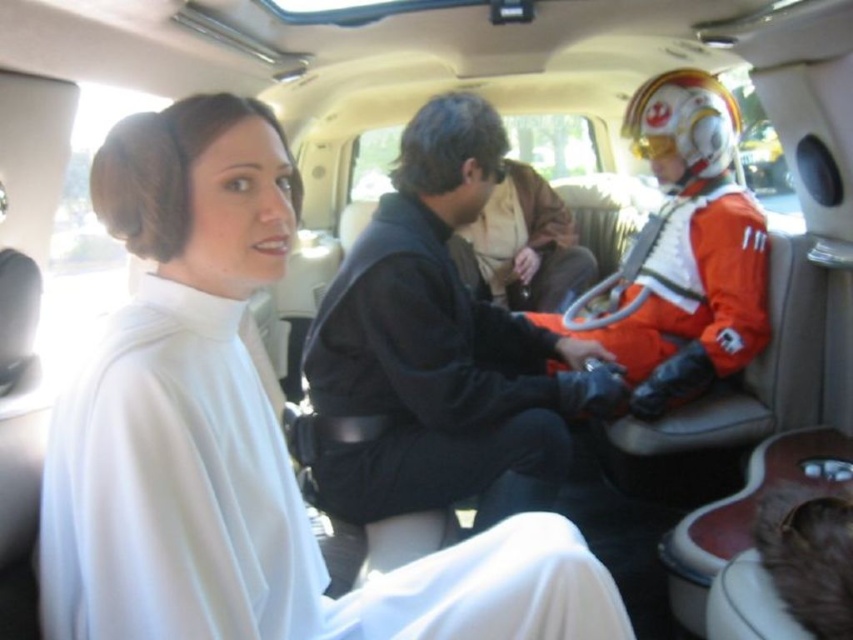
Can you confirm if black leather jacket at center is positioned above orange fabric helmet at right?

No.

Which is above, black leather jacket at center or orange fabric helmet at right?

Positioned higher is orange fabric helmet at right.

You are a GUI agent. You are given a task and a screenshot of the screen. Output one action in this format:
    pyautogui.click(x=<x>, y=<y>)
    Task: Click on the black leather jacket at center
    
    Given the screenshot: What is the action you would take?
    pyautogui.click(x=437, y=353)

Looking at this image, can you confirm if white satin dress at left is positioned below orange fabric helmet at right?

Correct, white satin dress at left is located below orange fabric helmet at right.

Who is more forward, (461, 600) or (618, 355)?

Point (461, 600) is in front.

Identify the location of white satin dress at left. The height and width of the screenshot is (640, 853). (241, 436).

Locate an element on the screen. The width and height of the screenshot is (853, 640). white satin dress at left is located at coordinates (241, 436).

Consider the image. Can you confirm if white satin dress at left is smaller than black leather jacket at center?

Correct, white satin dress at left occupies less space than black leather jacket at center.

Is point (315, 563) closer to camera compared to point (459, 308)?

Yes, it is.

Who is more distant from viewer, (x=274, y=436) or (x=442, y=419)?

Point (x=442, y=419)

Where is `white satin dress at left`? white satin dress at left is located at coordinates (241, 436).